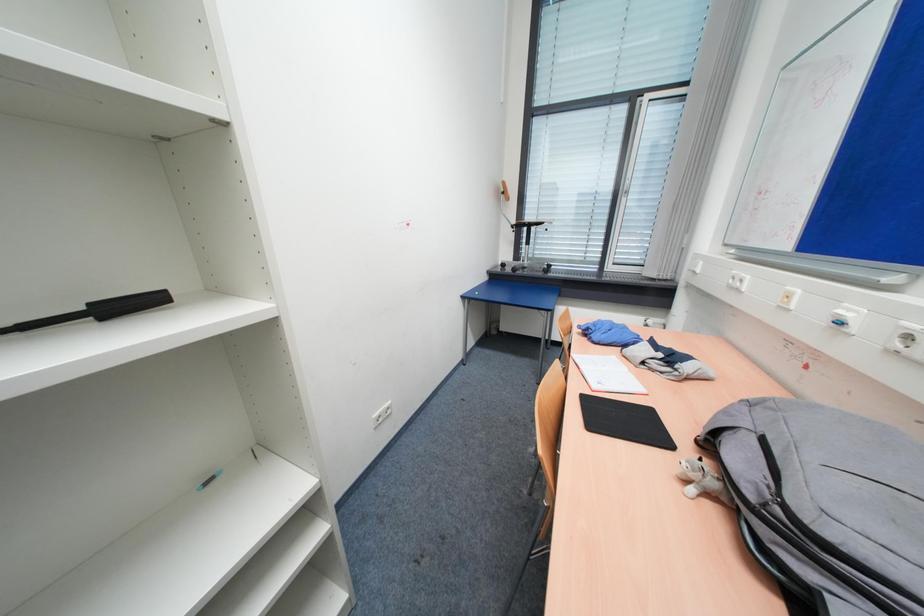
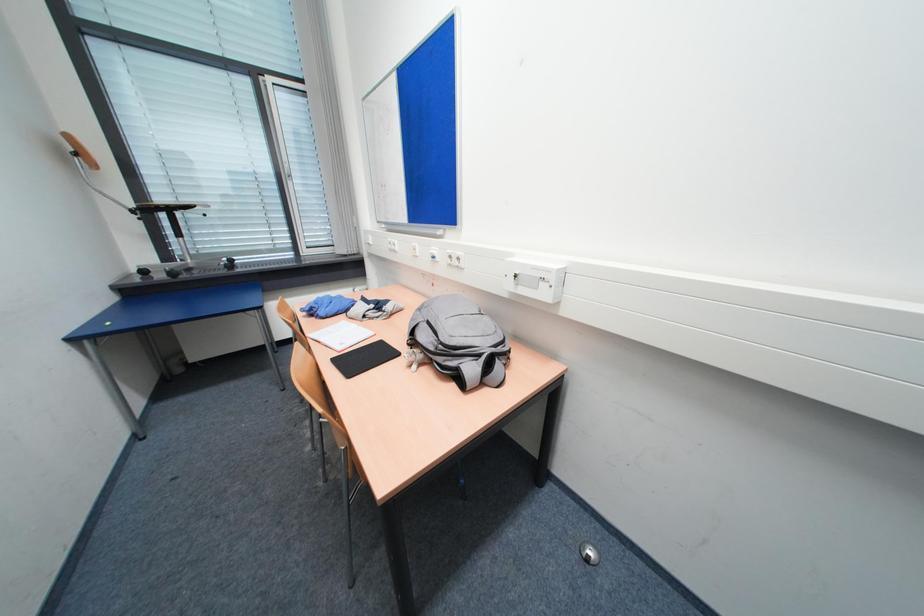
Question: The first image is from the beginning of the video and the second image is from the end. How did the camera likely rotate when shooting the video?

Choices:
 (A) Left
 (B) Right
 (C) Up
 (D) Down

Answer: (B)